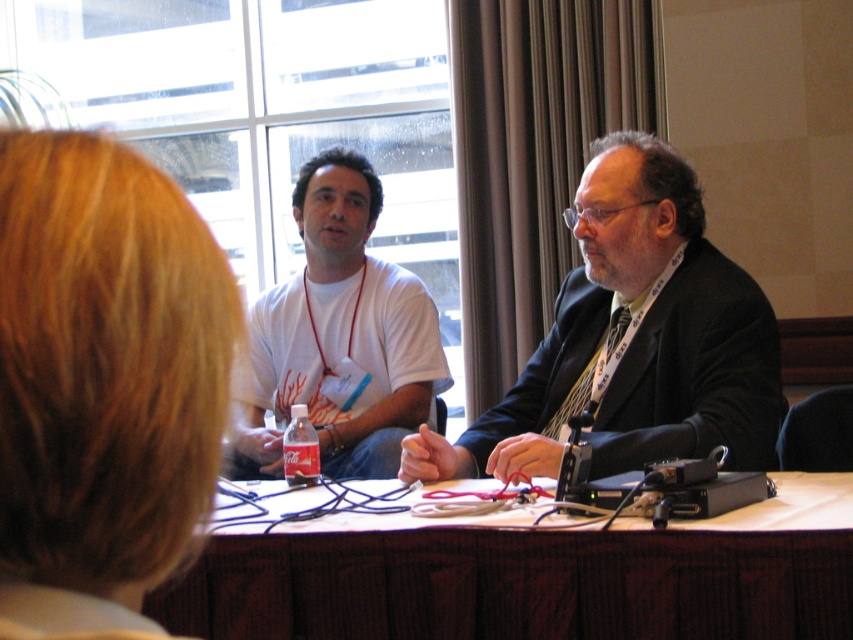
You are an event planner arranging a photo shoot in this room. The photographer wants to place a light source at position point 0.6, 0.1 to highlight the blonde hair at upper left. Is this possible given the current setup?

The blonde hair at upper left is located at point [105,365], so placing a light source at point [84,384] would be very close and feasible to highlight the blonde hair at upper left.